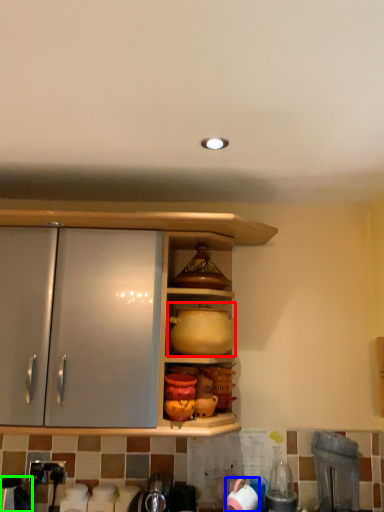
Question: Which is nearer to the pottery (highlighted by a red box)? tableware (highlighted by a blue box) or appliance (highlighted by a green box).

Choices:
 (A) tableware
 (B) appliance

Answer: (A)